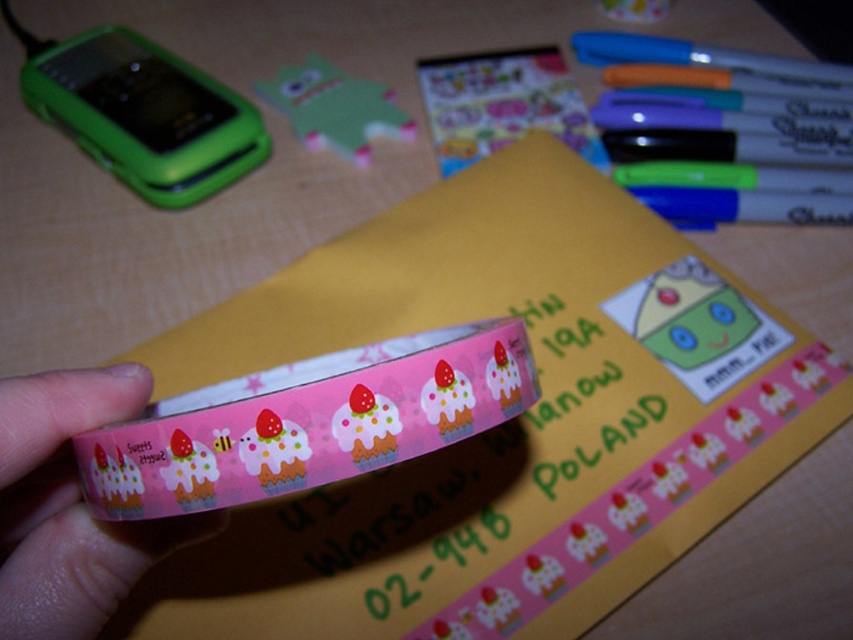
Question: Which object is positioned closest to the green matte phone at upper left?

Choices:
 (A) pink matte tape at center
 (B) pink glossy sticker at center

Answer: (B)

Question: Which object is the farthest from the metallic silver markers at upper right?

Choices:
 (A) pink glossy sticker at center
 (B) green matte phone at upper left
 (C) blue glossy marker at upper right
 (D) pink matte tape at center

Answer: (B)

Question: Is the position of pink matte tape at center less distant than that of blue glossy marker at upper right?

Choices:
 (A) no
 (B) yes

Answer: (B)

Question: In this image, where is pink glossy tape at center located relative to pink glossy sticker at center?

Choices:
 (A) right
 (B) left

Answer: (B)

Question: Is pink matte tape at center below pink glossy sticker at center?

Choices:
 (A) yes
 (B) no

Answer: (A)

Question: Which point is closer to the camera?

Choices:
 (A) green matte phone at upper left
 (B) pink glossy sticker at center

Answer: (A)